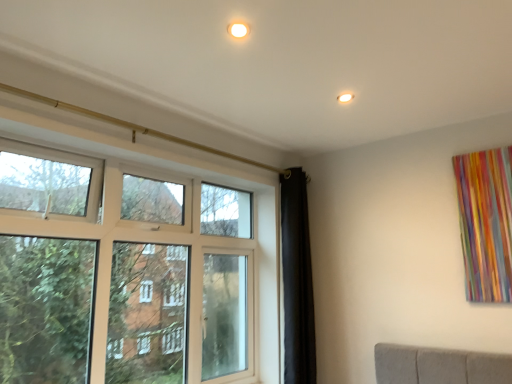
Question: Should I look upward or downward to see matte white window at left?

Choices:
 (A) up
 (B) down

Answer: (B)